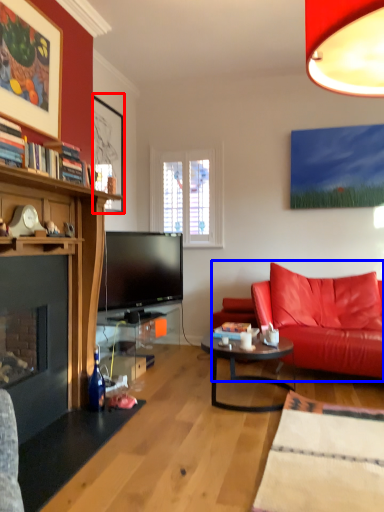
Question: Which object appears farthest to the camera in this image, picture frame (highlighted by a red box) or studio couch (highlighted by a blue box)?

Choices:
 (A) picture frame
 (B) studio couch

Answer: (A)